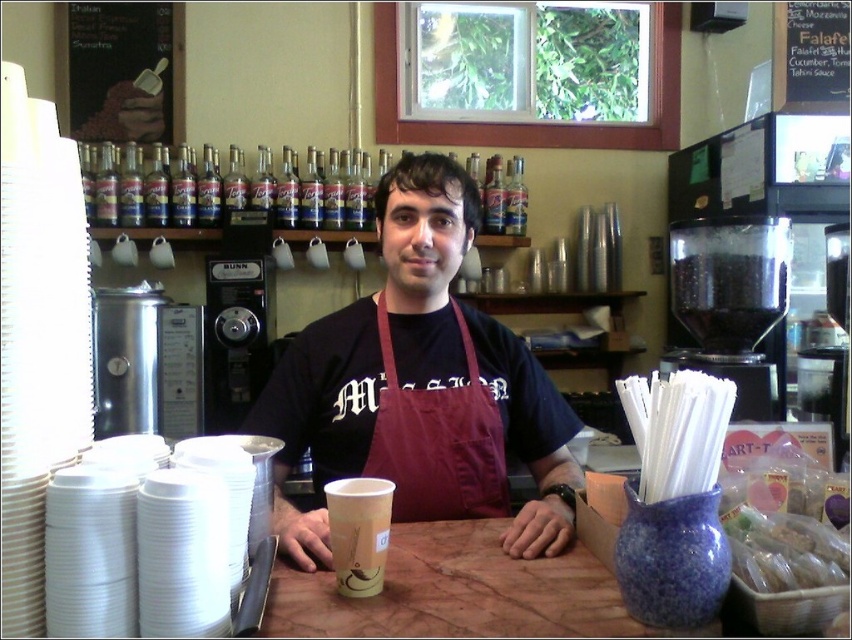
Question: Which of the following is the farthest from the observer?

Choices:
 (A) maroon apron at center
 (B) black plastic coffee machine at right
 (C) brown marble table at center
 (D) translucent plastic bag at lower right

Answer: (B)

Question: Considering the real-world distances, which object is closest to the translucent plastic bag at lower right?

Choices:
 (A) black plastic coffee machine at right
 (B) brown marble table at center
 (C) maroon apron at center

Answer: (B)

Question: Among these objects, which one is farthest from the camera?

Choices:
 (A) maroon apron at center
 (B) brown marble table at center
 (C) black plastic coffee machine at right

Answer: (C)

Question: From the image, what is the correct spatial relationship of maroon apron at center in relation to translucent plastic bag at lower right?

Choices:
 (A) left
 (B) right

Answer: (A)

Question: Considering the relative positions of black plastic coffee machine at right and translucent plastic bag at lower right in the image provided, where is black plastic coffee machine at right located with respect to translucent plastic bag at lower right?

Choices:
 (A) right
 (B) left

Answer: (A)

Question: Is maroon apron at center positioned behind black plastic coffee machine at right?

Choices:
 (A) yes
 (B) no

Answer: (B)